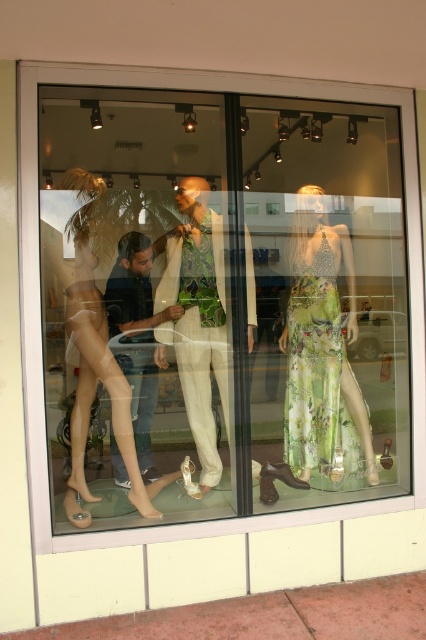
Is transparent plastic mannequin at center smaller than translucent plastic dress at center?

No.

Which of these two, transparent plastic mannequin at center or translucent plastic dress at center, stands shorter?

translucent plastic dress at center is shorter.

The width and height of the screenshot is (426, 640). What do you see at coordinates (218, 296) in the screenshot?
I see `transparent plastic mannequin at center` at bounding box center [218, 296].

This screenshot has height=640, width=426. I want to click on transparent plastic mannequin at center, so click(218, 296).

This screenshot has height=640, width=426. What do you see at coordinates (322, 360) in the screenshot?
I see `green floral dress at center` at bounding box center [322, 360].

Can you confirm if green floral dress at center is wider than white fabric suit at center?

Correct, the width of green floral dress at center exceeds that of white fabric suit at center.

Where is `green floral dress at center`? This screenshot has height=640, width=426. green floral dress at center is located at coordinates pos(322,360).

Can you confirm if green floral dress at center is positioned to the right of translucent plastic dress at center?

Indeed, green floral dress at center is positioned on the right side of translucent plastic dress at center.

Is green floral dress at center wider than translucent plastic dress at center?

No, green floral dress at center is not wider than translucent plastic dress at center.

Find the location of a particular element. green floral dress at center is located at coordinates (322, 360).